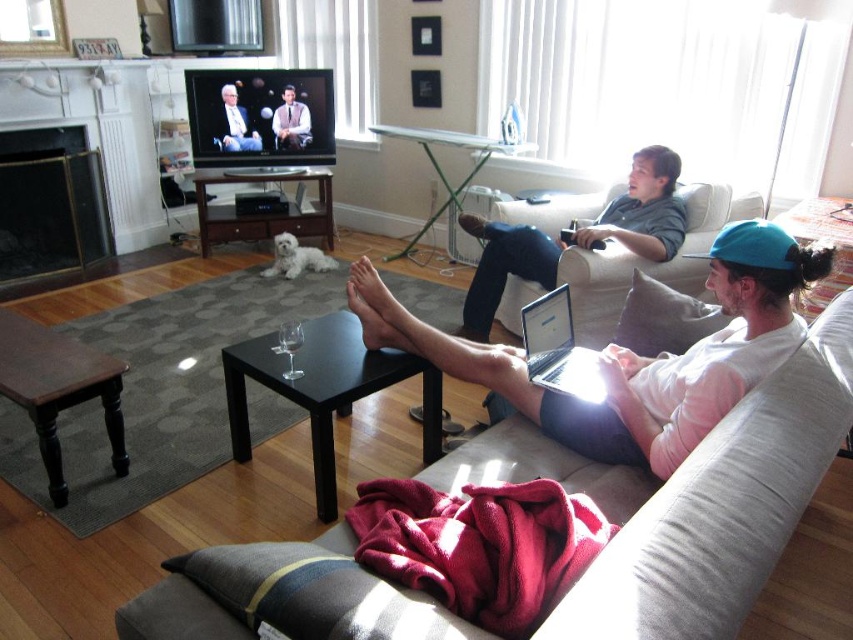
You are a delivery robot with a package that needs to be placed between the silver metallic laptop at center and the smooth black suit at center. The package measures 3 meters in length. Will the space between them accommodate the package?

The distance between the silver metallic laptop at center and the smooth black suit at center is 3.28 meters. Since the package is 3 meters long, it will fit within the available space.

You are standing at the point labeled as point (537, 348) in the living room. You want to take a photo of the television screen using a camera that has a minimum focus distance of 7 feet. Will the camera be able to focus on the television screen from your current position?

The point labeled as point (537, 348) and the camera are 7.25 feet apart. Since the minimum focus distance of the camera is 7 feet, the distance of 7.25 feet is slightly beyond the minimum requirement. Therefore, the camera should be able to focus on the television screen from this position.